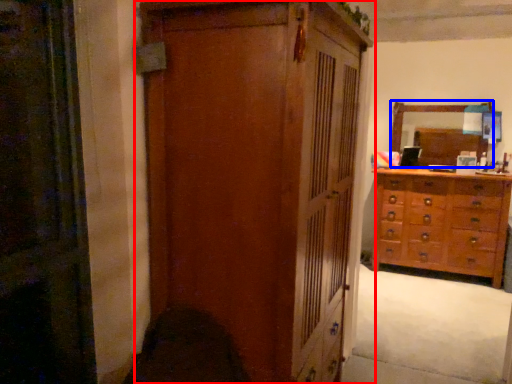
Question: Among these objects, which one is farthest to the camera, cupboard (highlighted by a red box) or mirror (highlighted by a blue box)?

Choices:
 (A) cupboard
 (B) mirror

Answer: (B)